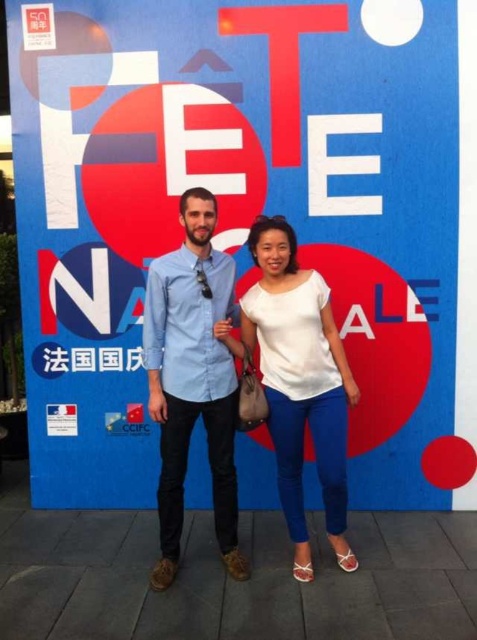
Question: Is blue denim shirt at center below white matte blouse at center?

Choices:
 (A) yes
 (B) no

Answer: (B)

Question: Does blue denim shirt at center have a lesser width compared to white matte blouse at center?

Choices:
 (A) no
 (B) yes

Answer: (B)

Question: Is blue denim shirt at center to the left of white matte blouse at center from the viewer's perspective?

Choices:
 (A) yes
 (B) no

Answer: (A)

Question: Which of the following is the farthest from the observer?

Choices:
 (A) blue denim shirt at center
 (B) white matte blouse at center

Answer: (B)

Question: Which object is closer to the camera taking this photo?

Choices:
 (A) white matte blouse at center
 (B) blue denim shirt at center

Answer: (B)

Question: Which of the following is the closest to the observer?

Choices:
 (A) blue denim shirt at center
 (B) white matte blouse at center

Answer: (A)